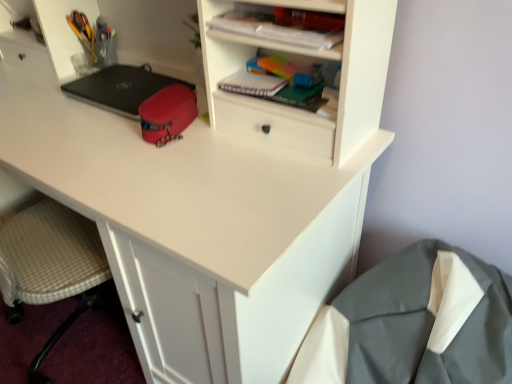
Question: From a real-world perspective, is black matte laptop at center positioned under gray fabric sleeping bag at lower right based on gravity?

Choices:
 (A) yes
 (B) no

Answer: (B)

Question: Is black matte laptop at center facing towards gray fabric sleeping bag at lower right?

Choices:
 (A) yes
 (B) no

Answer: (B)

Question: Could gray fabric sleeping bag at lower right be considered to be inside black matte laptop at center?

Choices:
 (A) no
 (B) yes

Answer: (A)

Question: Does black matte laptop at center have a larger size compared to gray fabric sleeping bag at lower right?

Choices:
 (A) yes
 (B) no

Answer: (B)

Question: Considering the relative positions of black matte laptop at center and gray fabric sleeping bag at lower right in the image provided, is black matte laptop at center in front of gray fabric sleeping bag at lower right?

Choices:
 (A) yes
 (B) no

Answer: (B)

Question: Does black matte laptop at center have a greater height compared to gray fabric sleeping bag at lower right?

Choices:
 (A) no
 (B) yes

Answer: (A)

Question: Is plaid paper notebook at upper center taller than gray fabric sleeping bag at lower right?

Choices:
 (A) yes
 (B) no

Answer: (B)

Question: Can you confirm if plaid paper notebook at upper center is smaller than gray fabric sleeping bag at lower right?

Choices:
 (A) no
 (B) yes

Answer: (B)

Question: From the image's perspective, does plaid paper notebook at upper center appear higher than gray fabric sleeping bag at lower right?

Choices:
 (A) no
 (B) yes

Answer: (B)

Question: Is plaid paper notebook at upper center wider than gray fabric sleeping bag at lower right?

Choices:
 (A) no
 (B) yes

Answer: (A)

Question: Is plaid paper notebook at upper center outside gray fabric sleeping bag at lower right?

Choices:
 (A) yes
 (B) no

Answer: (A)

Question: Does plaid paper notebook at upper center lie in front of gray fabric sleeping bag at lower right?

Choices:
 (A) yes
 (B) no

Answer: (B)

Question: Does matte plastic notebook at upper center have a greater width compared to metallic pen holder at upper left, which is the second stationery from bottom to top?

Choices:
 (A) yes
 (B) no

Answer: (A)